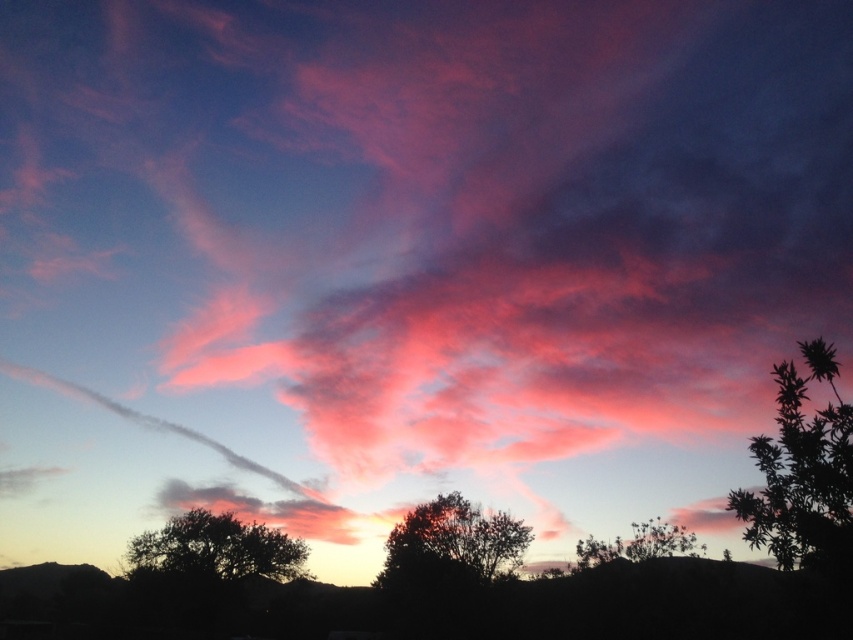
You are an artist planning to paint the sunset scene. You want to ensure the silvery metallic tree at right and the silvery metallic tree at lower right are proportionally accurate. Which tree should you make larger in your painting?

The silvery metallic tree at right should be made larger in the painting because it is larger in size than the silvery metallic tree at lower right according to the description.

You are an astronaut on Mars and you see two silvery metallic trees in the distance. One is labeled as the silvery metallic tree at right and the other as the silvery metallic tree at lower right. From your vantage point, which tree is positioned to the left of the other?

The silvery metallic tree at right is positioned to the left of the silvery metallic tree at lower right.

In the sunset scene, you see a silvery metallic tree at right and a silhouette tree at lower left. Which tree is positioned more to the east if the sun is setting in the west?

The silvery metallic tree at right is positioned more to the east because it is to the right of the silhouette tree at lower left, and since the sun is setting in the west, the right side of the image would correspond to the east direction.